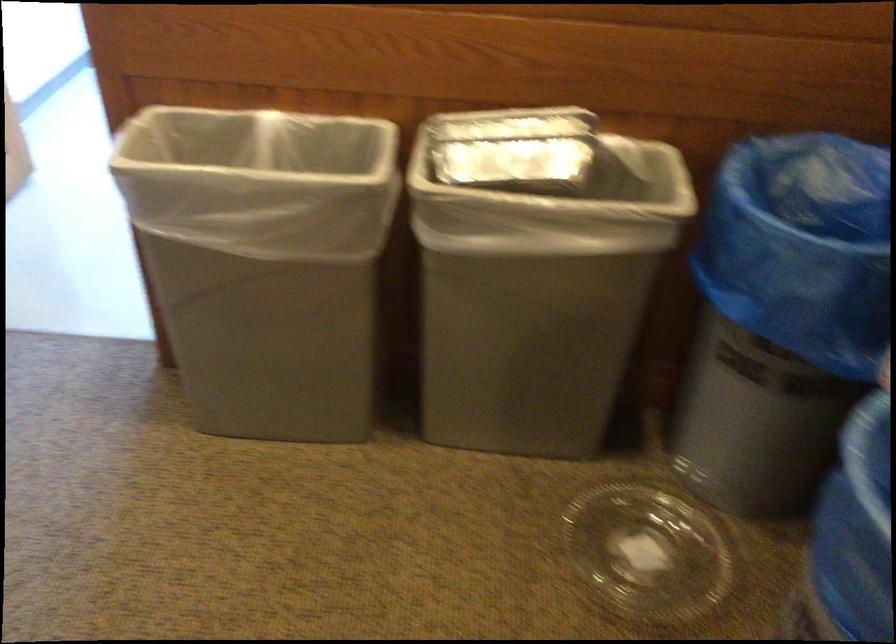
Find the location of a particular element. The height and width of the screenshot is (644, 896). clear plastic lid is located at coordinates (648, 552).